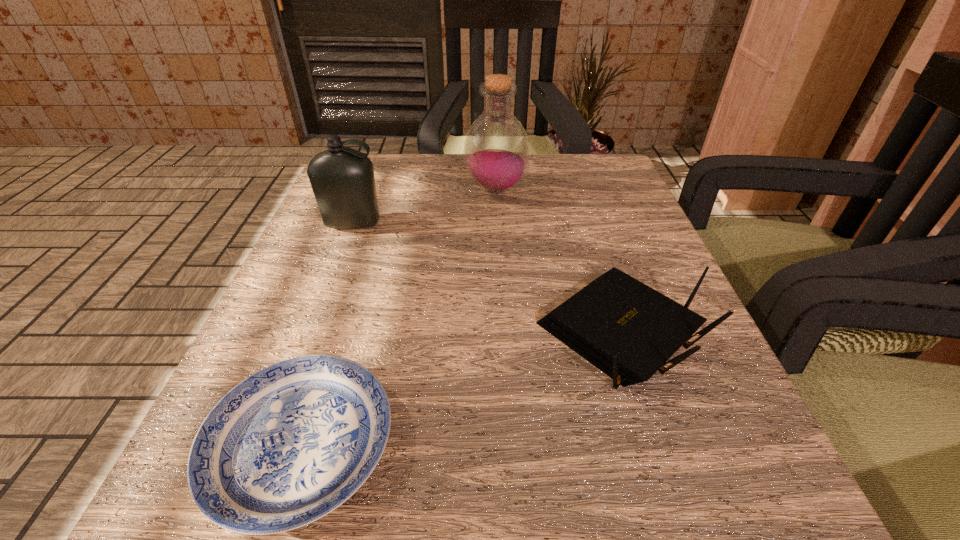
I want to click on empty space that is in between the shorter bottle and the taller bottle, so click(424, 207).

The height and width of the screenshot is (540, 960). I want to click on vacant space that's between the left bottle and the router, so click(486, 278).

This screenshot has height=540, width=960. In order to click on free area in between the taller bottle and the nearer bottle in this screenshot , I will do `click(424, 207)`.

Find the location of `the closest object to the third nearest object`. the closest object to the third nearest object is located at coordinates (496, 150).

Select which object is the second closest to the router. Please provide its 2D coordinates. Your answer should be formatted as a tuple, i.e. [(x, y)], where the tuple contains the x and y coordinates of a point satisfying the conditions above.

[(496, 150)]

What are the coordinates of `vacant area in the image that satisfies the following two spatial constraints: 1. on the front side of the third nearest object; 2. on the right side of the router` in the screenshot? It's located at (311, 332).